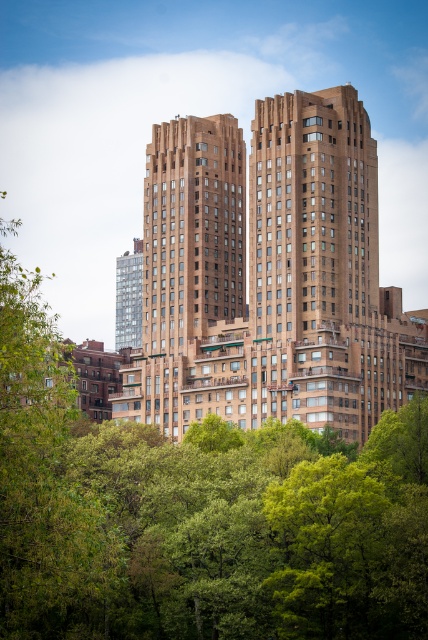
Can you confirm if brown brick building at center is taller than green leafy tree at left?

Incorrect, brown brick building at center's height is not larger of green leafy tree at left's.

Between brown brick building at center and green leafy tree at left, which one has less height?

brown brick building at center

Which is behind, point (226, 184) or point (95, 584)?

The point (226, 184) is behind.

Locate an element on the screen. This screenshot has height=640, width=428. brown brick building at center is located at coordinates (270, 275).

Can you confirm if green leafy tree at center is thinner than brown brick building at center?

In fact, green leafy tree at center might be wider than brown brick building at center.

Who is more forward, (154, 564) or (335, 228)?

Point (154, 564) is in front.

Locate an element on the screen. The width and height of the screenshot is (428, 640). green leafy tree at center is located at coordinates (196, 515).

Who is more distant from viewer, (67, 499) or (20, 540)?

The point (67, 499) is behind.

Between point (20, 385) and point (5, 563), which one is positioned in front?

Positioned in front is point (5, 563).

Is point (151, 428) farther from camera compared to point (30, 288)?

Yes.

Find the location of `green leafy tree at center`. green leafy tree at center is located at coordinates (196, 515).